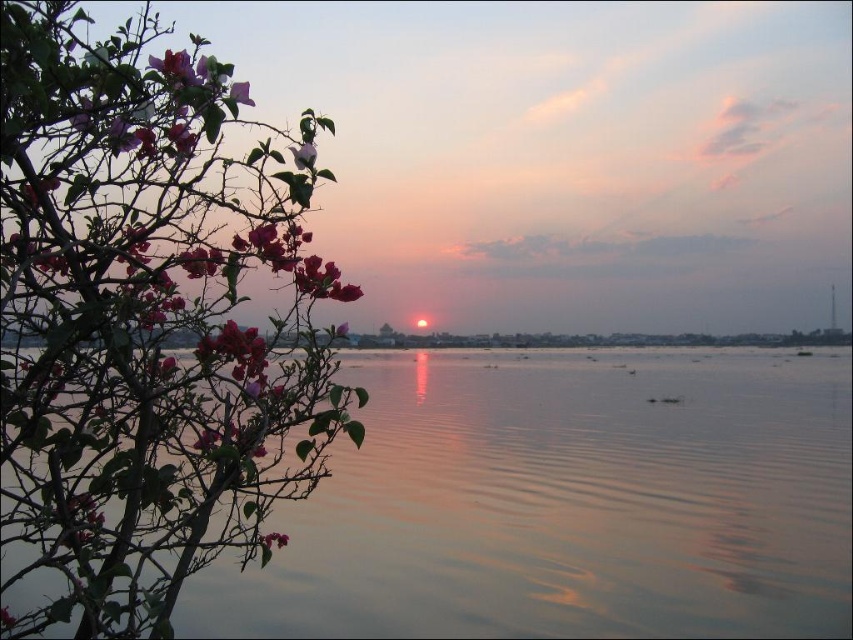
Question: Which of the following is the farthest from the observer?

Choices:
 (A) smooth water at center
 (B) purple matte flower at upper left

Answer: (A)

Question: Can you confirm if smooth water at center is positioned below pink matte leaves at left?

Choices:
 (A) no
 (B) yes

Answer: (B)

Question: Is pink matte leaves at left to the right of purple matte flower at upper left from the viewer's perspective?

Choices:
 (A) no
 (B) yes

Answer: (A)

Question: Among these objects, which one is farthest from the camera?

Choices:
 (A) purple matte flower at upper left
 (B) pink matte flower at upper left

Answer: (B)

Question: Does smooth water at center appear on the left side of purple matte flower at upper left?

Choices:
 (A) no
 (B) yes

Answer: (A)

Question: Which of the following is the farthest from the observer?

Choices:
 (A) (283, 532)
 (B) (583, 611)
 (C) (245, 88)
 (D) (294, 147)

Answer: (B)